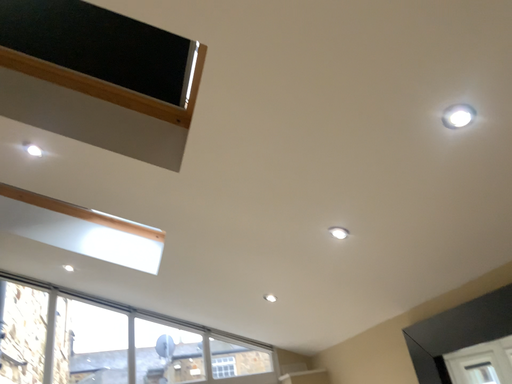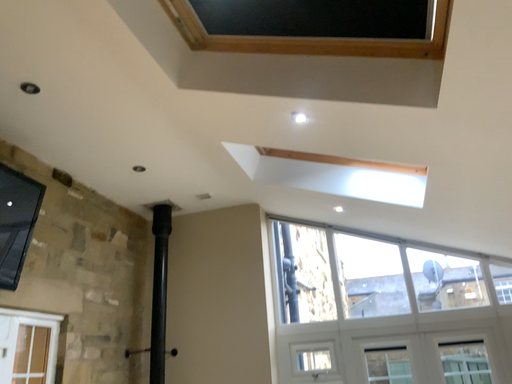
Question: Which way did the camera rotate in the video?

Choices:
 (A) rotated downward
 (B) rotated upward

Answer: (A)